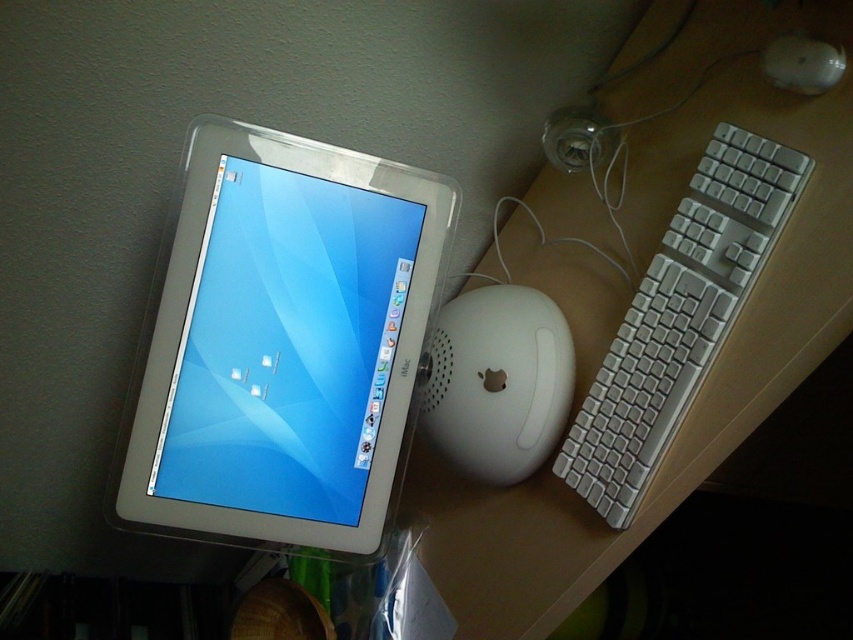
You are setting up a new computer monitor on your desk. The current setup has a white glossy computer monitor at upper left. Where should you place the new monitor to avoid direct sunlight reflection from the window located at the point with coordinates (x=281, y=342)?

The point with coordinates (x=281, y=342) indicates the white glossy computer monitor at upper left, so placing the new monitor away from that location would help avoid direct sunlight reflection from the window.

You are setting up a new desk arrangement and want to place a white glossy computer monitor at upper left and a white plastic keyboard at right. Given their positions, which object is closer to the bottom edge of the desk?

The white glossy computer monitor at upper left is closer to the bottom edge of the desk because it is positioned below the white plastic keyboard at right.